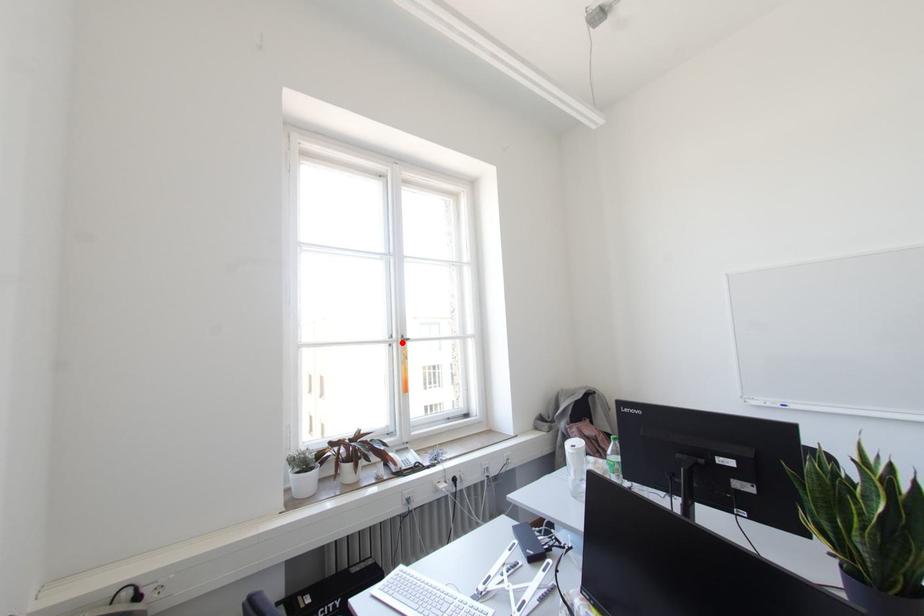
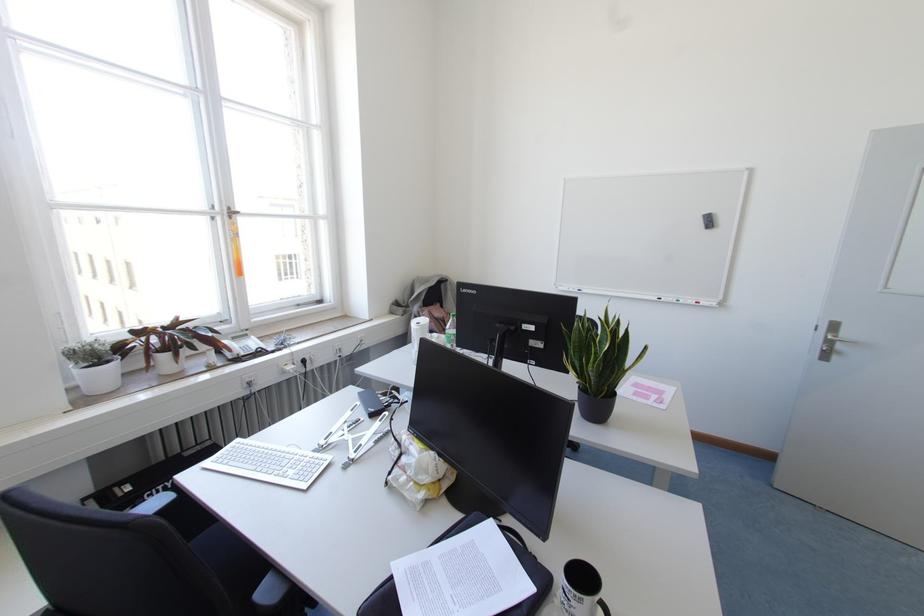
Where in the second image is the point corresponding to the highlighted location from the first image?

(229, 217)